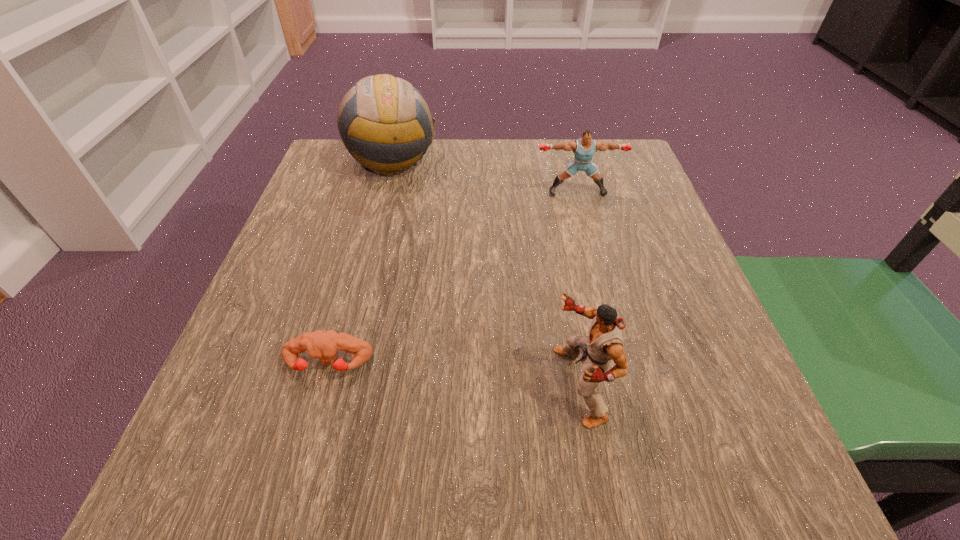
The image size is (960, 540). In the image, there is a desktop. Identify the location of free region at the near edge. (624, 483).

The width and height of the screenshot is (960, 540). I want to click on vacant space at the left edge of the desktop, so point(342,292).

Find the location of a particular element. vacant space at the right edge of the desktop is located at coordinates (650, 264).

Where is `vacant space at the far left corner`? The image size is (960, 540). vacant space at the far left corner is located at coordinates [x=381, y=192].

Where is `vacant point at the near left corner`? The width and height of the screenshot is (960, 540). vacant point at the near left corner is located at coordinates (300, 469).

Find the location of a particular element. vacant space at the far right corner is located at coordinates (645, 176).

At what (x,y) coordinates should I click in order to perform the action: click on free spot between the volleyball and the shortest object. Please return your answer as a coordinate pair (x, y). The width and height of the screenshot is (960, 540). Looking at the image, I should click on (360, 262).

Where is `unoccupied area between the farthest object and the tallest puncher`? The width and height of the screenshot is (960, 540). unoccupied area between the farthest object and the tallest puncher is located at coordinates click(486, 273).

Find the location of `free spot between the tallest puncher and the volleyball`. free spot between the tallest puncher and the volleyball is located at coordinates (486, 273).

In order to click on vacant region between the second shortest object and the shortest puncher in this screenshot , I will do `click(452, 278)`.